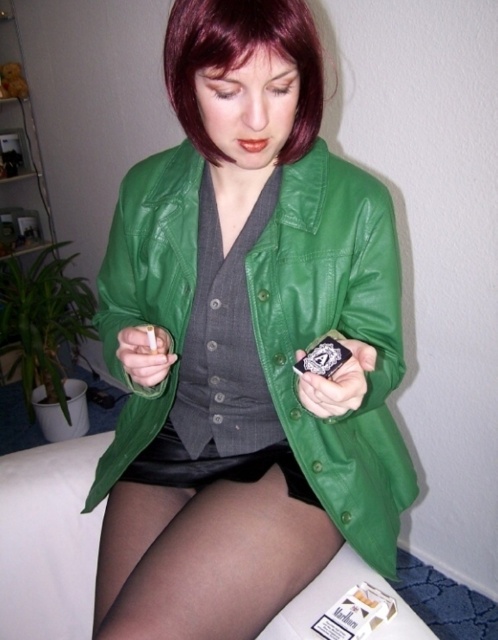
You are an interior designer assessing the spatial arrangement of this room. Considering the green leather jacket at center and the dark red silky hair at upper center, which object occupies more vertical space in the scene?

The green leather jacket at center occupies more vertical space than the dark red silky hair at upper center because it has a greater height compared to it.

You are a fashion designer trying to create a new outfit. You want to know if the green leather jacket at center can be worn over the black sheer tights at lower center without any adjustments. Based on their sizes, can this be done?

The green leather jacket at center might be wider than black sheer tights at lower center, so there is a possibility that the jacket could cover the tights sufficiently without needing adjustments.

You are standing in front of the couch and want to reach both points. Which point should you reach first, point at coordinate (300, 561) or point at coordinate (201, 141)?

You should reach point at coordinate (201, 141) first because it is closer to you than point at coordinate (300, 561), which is further away.